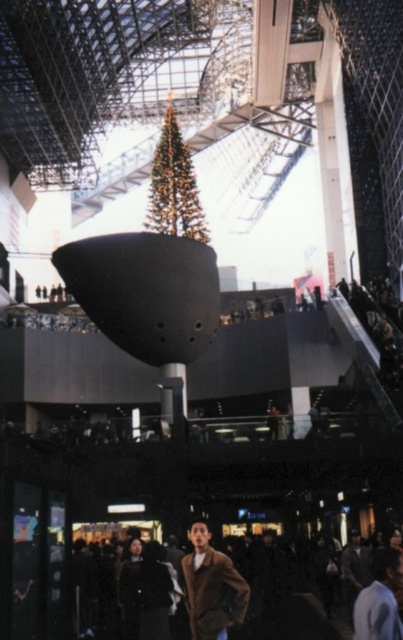
Measure the distance from brown wool coat at lower center to dark brown leather jacket at lower center.

brown wool coat at lower center is 13.98 meters from dark brown leather jacket at lower center.

Does brown wool coat at lower center have a lesser width compared to dark brown leather jacket at lower center?

No.

Between point (243, 609) and point (369, 602), which one is positioned behind?

Point (243, 609)

Locate an element on the screen. The height and width of the screenshot is (640, 403). brown wool coat at lower center is located at coordinates (211, 588).

What do you see at coordinates (211, 588) in the screenshot? I see `brown wool coat at lower center` at bounding box center [211, 588].

Does point (186, 596) come behind point (182, 166)?

No, it is not.

Measure the distance between brown wool coat at lower center and camera.

brown wool coat at lower center and camera are 57.75 meters apart.

In order to click on brown wool coat at lower center in this screenshot , I will do `click(211, 588)`.

Can you confirm if green textured christmas tree at center is wider than dark brown leather jacket at lower center?

Yes, green textured christmas tree at center is wider than dark brown leather jacket at lower center.

This screenshot has width=403, height=640. What do you see at coordinates (174, 186) in the screenshot?
I see `green textured christmas tree at center` at bounding box center [174, 186].

Image resolution: width=403 pixels, height=640 pixels. In order to click on green textured christmas tree at center in this screenshot , I will do `click(174, 186)`.